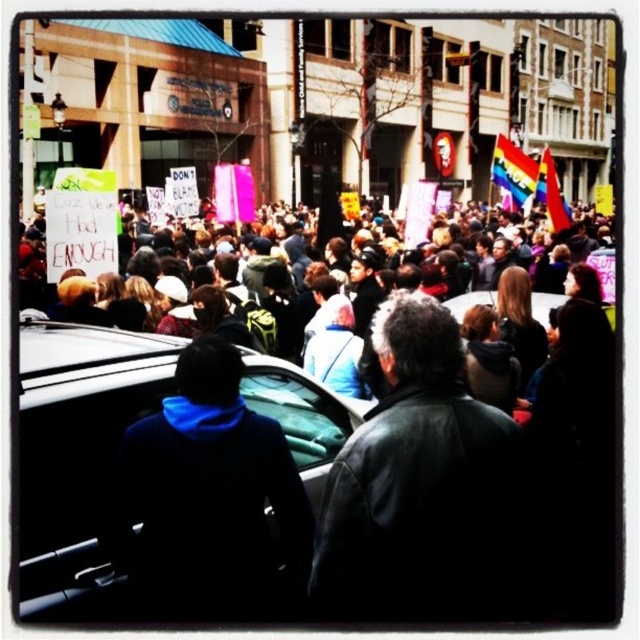
Question: Among these points, which one is nearest to the camera?

Choices:
 (A) (595, 259)
 (B) (349, 563)
 (C) (104, 436)

Answer: (C)

Question: Is black matte car at center in front of black leather jacket at center?

Choices:
 (A) yes
 (B) no

Answer: (A)

Question: Considering the relative positions of multicolored fabric crowd at center and black leather jacket at center in the image provided, where is multicolored fabric crowd at center located with respect to black leather jacket at center?

Choices:
 (A) below
 (B) above

Answer: (B)

Question: Which point is farther to the camera?

Choices:
 (A) (500, 451)
 (B) (243, 483)
 (C) (323, 280)

Answer: (C)

Question: Which of these objects is positioned farthest from the multicolored fabric crowd at center?

Choices:
 (A) black matte car at center
 (B) black leather jacket at center

Answer: (A)

Question: Does black matte car at center have a lesser width compared to multicolored fabric crowd at center?

Choices:
 (A) yes
 (B) no

Answer: (A)